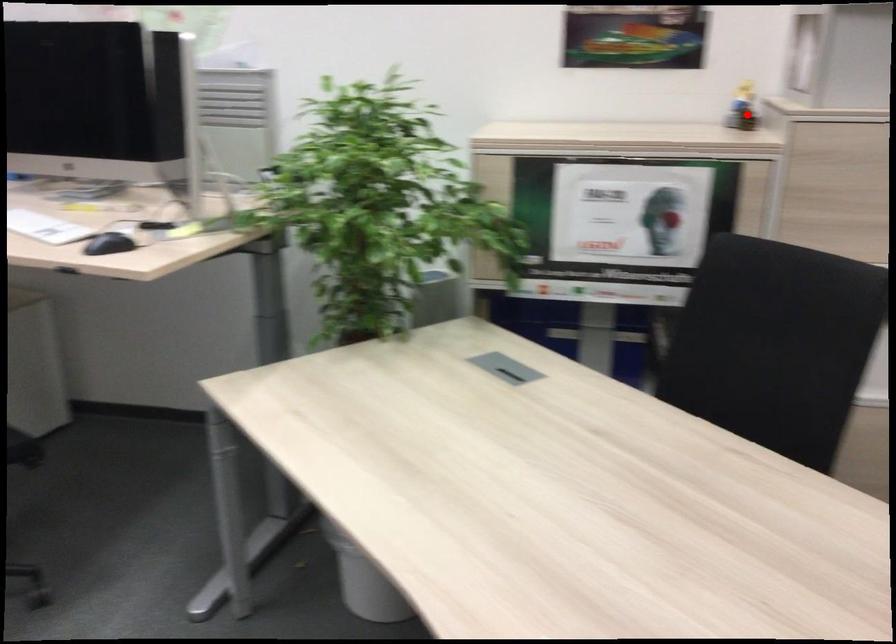
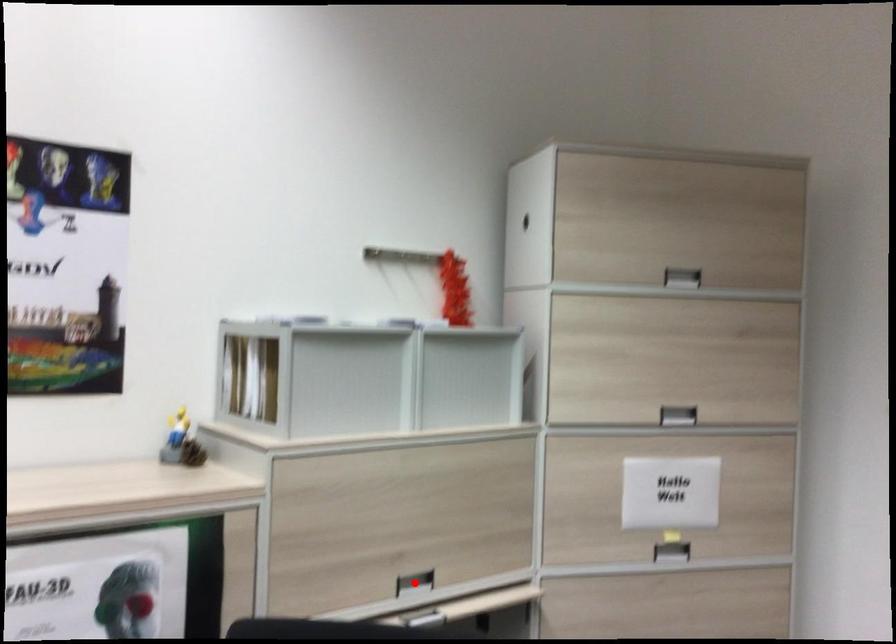
I am providing you with two images of the same scene from different viewpoints. A red point is marked on the first image and another point is marked on the second image. Is the red point in image1 aligned with the point shown in image2?

No